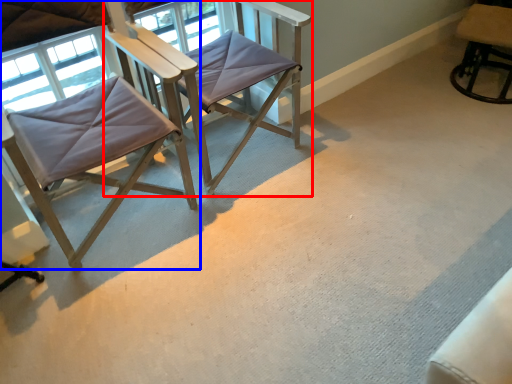
Question: Among these objects, which one is nearest to the camera, chair (highlighted by a red box) or chair (highlighted by a blue box)?

Choices:
 (A) chair
 (B) chair

Answer: (B)